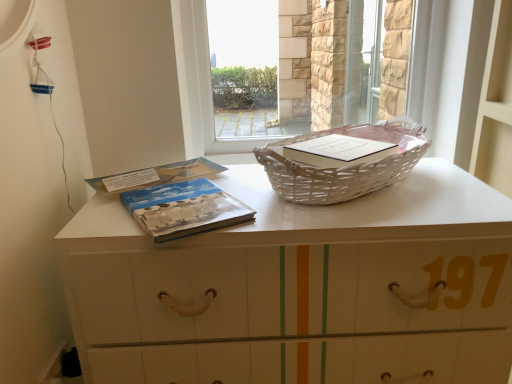
This screenshot has height=384, width=512. I want to click on vacant space situated on the left part of matte blue cover book at center, the first paperback book positioned from the front, so click(x=103, y=216).